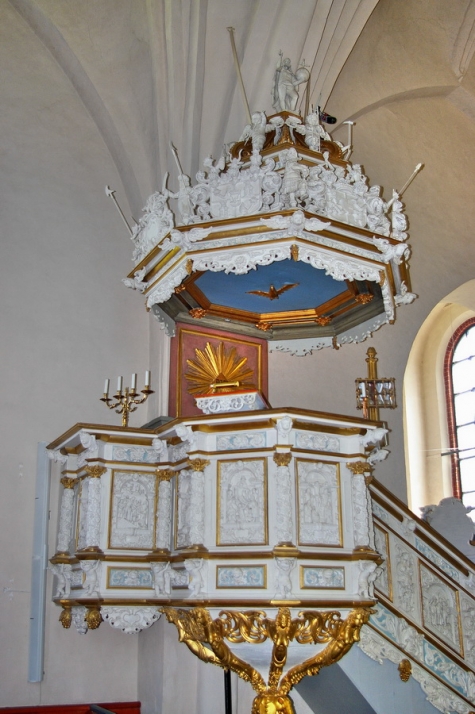
I want to click on window, so click(x=465, y=413).